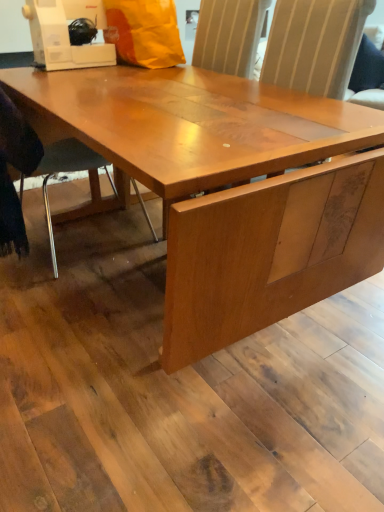
The width and height of the screenshot is (384, 512). What are the coordinates of `free space in front of metallic gray chair at lower left` in the screenshot? It's located at (69, 310).